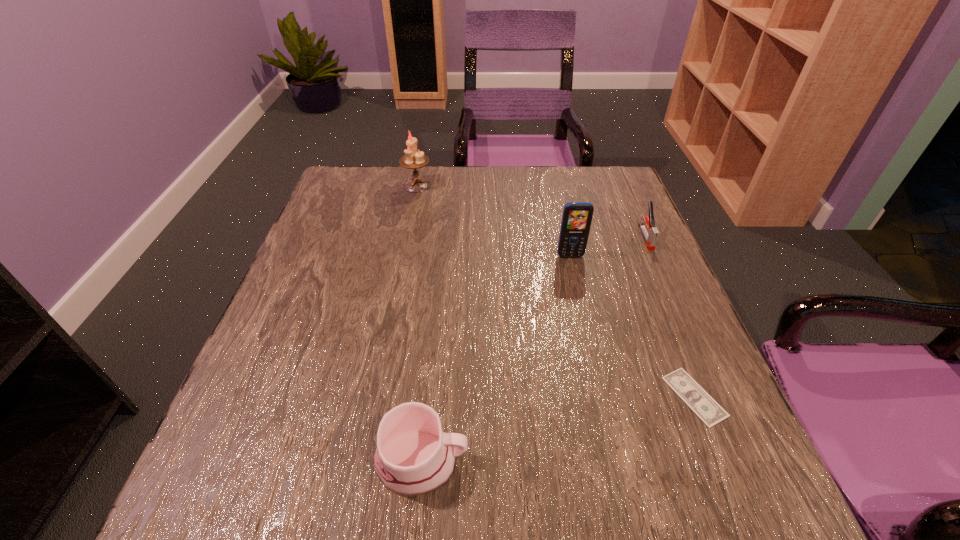
I want to click on vacant region located on the side with the handle of the mug, so click(642, 462).

Locate an element on the screen. Image resolution: width=960 pixels, height=540 pixels. vacant region located on the back of the second nearest object is located at coordinates (646, 276).

Where is `object at the far edge`? object at the far edge is located at coordinates (413, 159).

Identify the location of object at the near edge. (413, 457).

Where is `stapler at the right edge`? stapler at the right edge is located at coordinates (651, 234).

Find the location of a particular element. The height and width of the screenshot is (540, 960). money present at the right edge is located at coordinates (695, 397).

I want to click on free space at the far edge of the desktop, so click(x=469, y=176).

This screenshot has height=540, width=960. In the image, there is a desktop. In order to click on vacant space at the near edge in this screenshot , I will do `click(476, 497)`.

The width and height of the screenshot is (960, 540). In order to click on vacant space at the left edge of the desktop in this screenshot , I will do `click(279, 314)`.

The width and height of the screenshot is (960, 540). What are the coordinates of `vacant area at the right edge` in the screenshot? It's located at (626, 236).